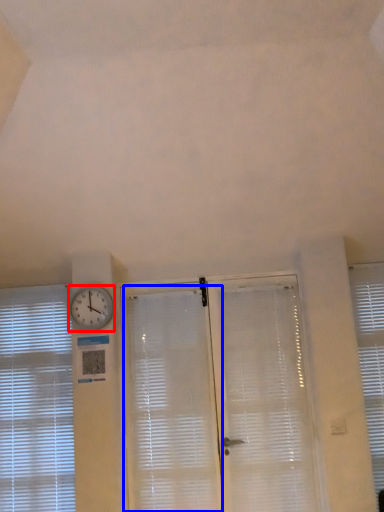
Question: Among these objects, which one is nearest to the camera, clock (highlighted by a red box) or shutter (highlighted by a blue box)?

Choices:
 (A) clock
 (B) shutter

Answer: (B)